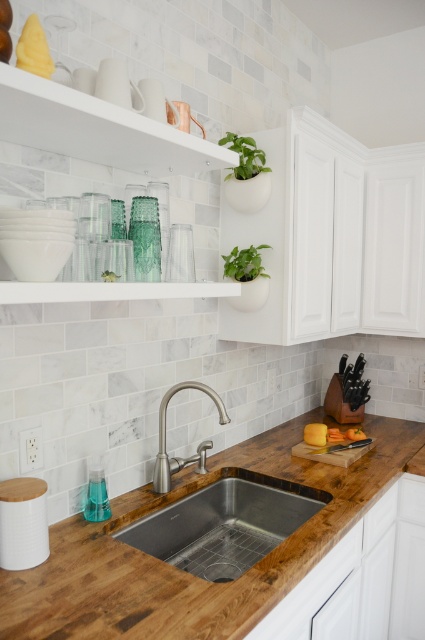
Who is shorter, wooden countertop at center or brushed nickel faucet at center?

With less height is wooden countertop at center.

Image resolution: width=425 pixels, height=640 pixels. In order to click on wooden countertop at center in this screenshot , I will do (187, 573).

Where is `wooden countertop at center`? wooden countertop at center is located at coordinates (187, 573).

Can you confirm if wooden countertop at center is thinner than stainless steel sink at center?

In fact, wooden countertop at center might be wider than stainless steel sink at center.

From the picture: Does wooden countertop at center lie in front of stainless steel sink at center?

Yes, wooden countertop at center is closer to the viewer.

In order to click on wooden countertop at center in this screenshot , I will do `click(187, 573)`.

Where is `wooden countertop at center`? wooden countertop at center is located at coordinates (187, 573).

Locate an element on the screen. brushed nickel faucet at center is located at coordinates (164, 438).

Which is in front, point (189, 460) or point (241, 177)?

Positioned in front is point (189, 460).

This screenshot has height=640, width=425. Identify the location of brushed nickel faucet at center. [164, 438].